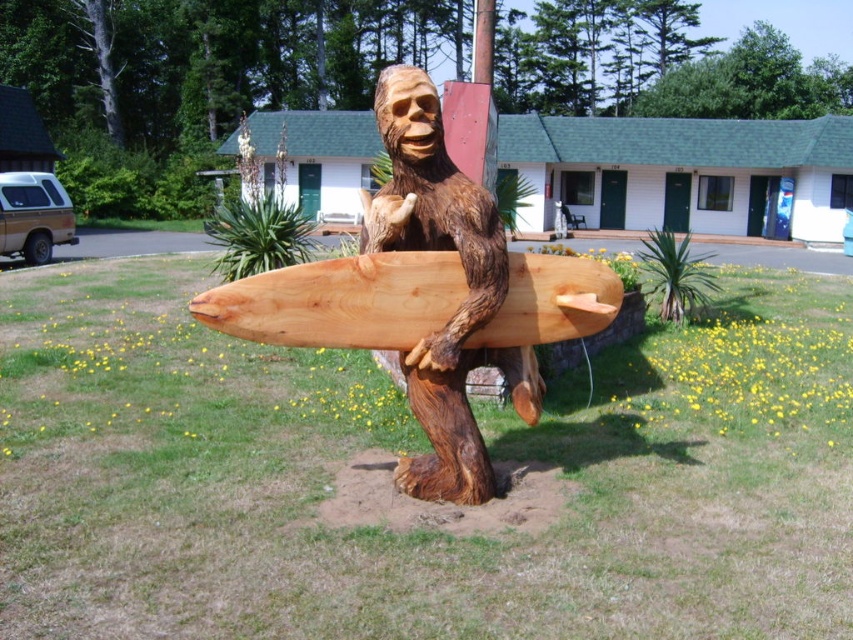
Question: Which object is closer to the camera taking this photo?

Choices:
 (A) natural wood surfboard at center
 (B) wooden surfboard at center
 (C) brown wood carving at center

Answer: (A)

Question: Is wooden surfboard at center to the right of natural wood surfboard at center from the viewer's perspective?

Choices:
 (A) yes
 (B) no

Answer: (A)

Question: Estimate the real-world distances between objects in this image. Which object is closer to the wooden surfboard at center?

Choices:
 (A) natural wood surfboard at center
 (B) brown wood carving at center

Answer: (B)

Question: Does brown wood carving at center lie in front of natural wood surfboard at center?

Choices:
 (A) yes
 (B) no

Answer: (B)

Question: Among these points, which one is nearest to the camera?

Choices:
 (A) (401, 243)
 (B) (401, 189)

Answer: (A)

Question: Can you confirm if brown wood carving at center is smaller than natural wood surfboard at center?

Choices:
 (A) no
 (B) yes

Answer: (B)